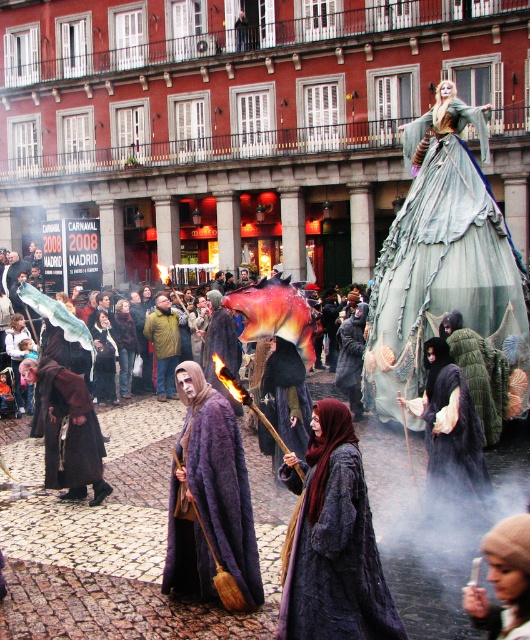
Question: Which point appears closest to the camera in this image?

Choices:
 (A) (410, 304)
 (B) (351, 362)

Answer: (A)

Question: Based on their relative distances, which object is nearer to the yellow-green fabric jacket at center?

Choices:
 (A) green sheer dress at upper right
 (B) dark velvet robe at center
 (C) purple woolen cloak at center
 (D) black velvet robe at center

Answer: (B)

Question: Is purple woolen cloak at center positioned before brown woolen robe at center?

Choices:
 (A) no
 (B) yes

Answer: (B)

Question: Which of the following is the farthest from the observer?

Choices:
 (A) (159, 342)
 (B) (437, 364)

Answer: (A)

Question: Is green sheer dress at upper right to the left of black velvet robe at center from the viewer's perspective?

Choices:
 (A) yes
 (B) no

Answer: (B)

Question: Is brown woolen robe at center bigger than yellow-green fabric jacket at center?

Choices:
 (A) yes
 (B) no

Answer: (A)